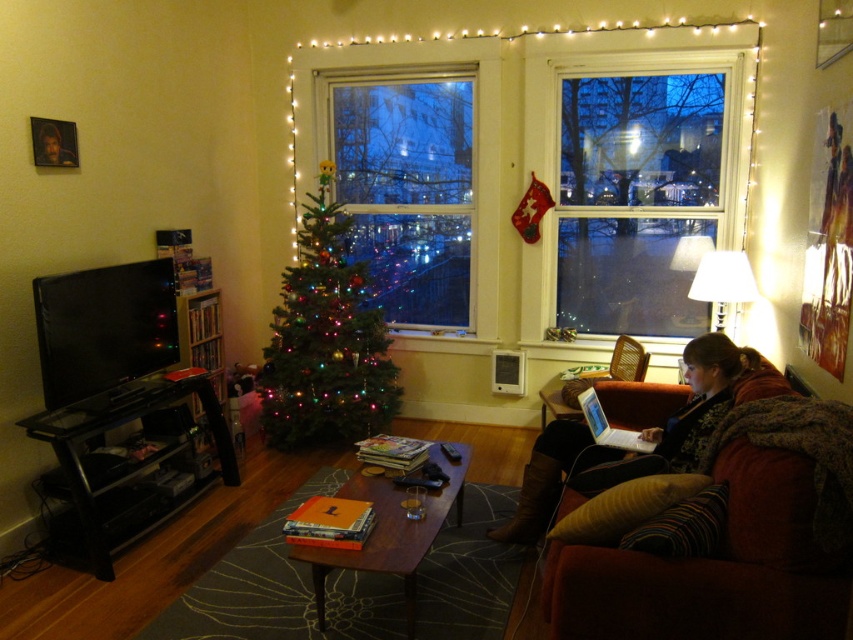
Is illuminated glass window at center above green matte christmas tree at center?

Correct, illuminated glass window at center is located above green matte christmas tree at center.

Does illuminated glass window at center come in front of green matte christmas tree at center?

No, illuminated glass window at center is further to the viewer.

Locate an element on the screen. The width and height of the screenshot is (853, 640). illuminated glass window at center is located at coordinates (407, 189).

Measure the distance between transparent glass window at center and leather boots at lower right.

transparent glass window at center is 5.75 feet away from leather boots at lower right.

Looking at this image, which of these two, transparent glass window at center or leather boots at lower right, stands taller?

transparent glass window at center

Is point (645, 284) positioned behind point (556, 429)?

Yes, point (645, 284) is behind point (556, 429).

The width and height of the screenshot is (853, 640). In order to click on transparent glass window at center in this screenshot , I will do `click(637, 200)`.

Consider the image. Between brown fabric couch at lower right and smooth brown leather jacket at lower right, which one is positioned higher?

smooth brown leather jacket at lower right

Which is behind, point (724, 632) or point (71, 163)?

Point (71, 163)

Measure the distance between brown fabric couch at lower right and camera.

brown fabric couch at lower right and camera are 5.79 feet apart from each other.

In order to click on brown fabric couch at lower right in this screenshot , I will do `click(712, 570)`.